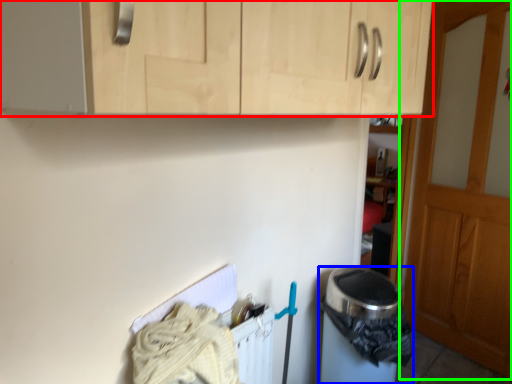
Question: Estimate the real-world distances between objects in this image. Which object is closer to cabinetry (highlighted by a red box), appliance (highlighted by a blue box) or door (highlighted by a green box)?

Choices:
 (A) appliance
 (B) door

Answer: (A)